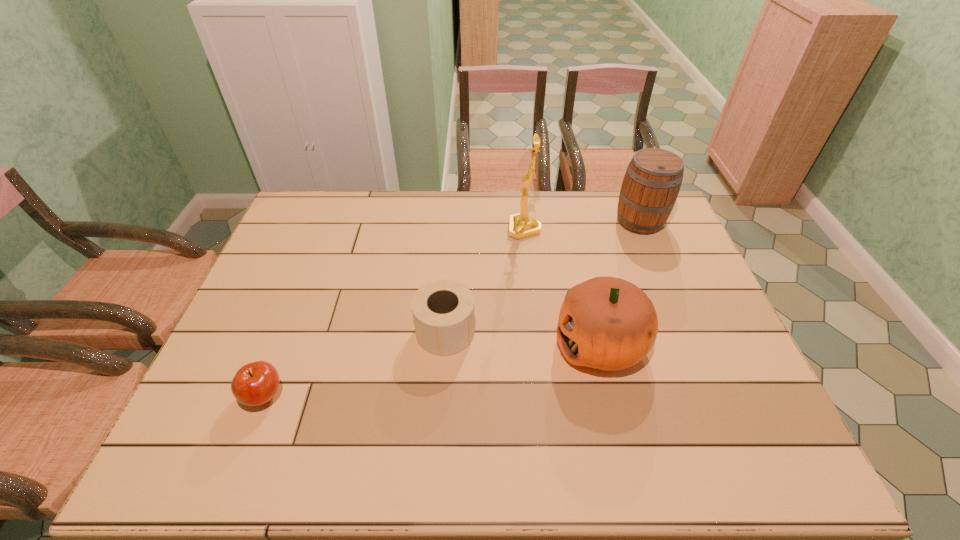
Identify the location of award. (521, 225).

Identify the location of the second tallest object. (650, 187).

Locate an element on the screen. This screenshot has width=960, height=540. cider is located at coordinates (650, 187).

At what (x,y) coordinates should I click in order to perform the action: click on pumpkin. Please return your answer as a coordinate pair (x, y). Looking at the image, I should click on (607, 323).

At what (x,y) coordinates should I click in order to perform the action: click on the second object from left to right. Please return your answer as a coordinate pair (x, y). This screenshot has width=960, height=540. Looking at the image, I should click on (443, 310).

Identify the location of the second shortest object. (443, 310).

Where is `apple`? This screenshot has height=540, width=960. apple is located at coordinates (254, 384).

This screenshot has height=540, width=960. I want to click on the leftmost object, so click(x=254, y=384).

This screenshot has width=960, height=540. In order to click on free space located on the front-facing side of the tallest object in this screenshot , I will do `click(444, 229)`.

Locate an element on the screen. This screenshot has width=960, height=540. vacant space situated on the front-facing side of the tallest object is located at coordinates (403, 229).